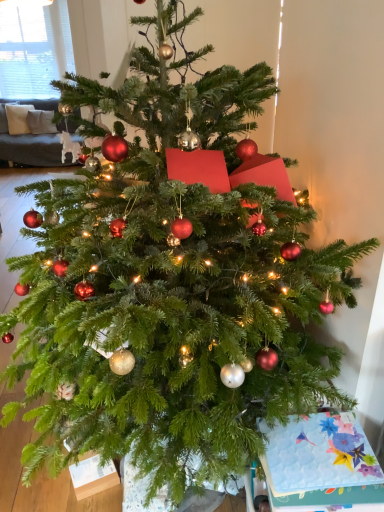
Question: Is white blinds at upper left wider or thinner than floral paper card at lower right?

Choices:
 (A) wide
 (B) thin

Answer: (B)

Question: Is white blinds at upper left inside the boundaries of floral paper card at lower right, or outside?

Choices:
 (A) outside
 (B) inside

Answer: (A)

Question: From the image's perspective, is white blinds at upper left above or below floral paper card at lower right?

Choices:
 (A) below
 (B) above

Answer: (B)

Question: In terms of height, does floral paper card at lower right look taller or shorter compared to white blinds at upper left?

Choices:
 (A) tall
 (B) short

Answer: (B)

Question: Is point (382, 473) positioned closer to the camera than point (39, 42)?

Choices:
 (A) farther
 (B) closer

Answer: (B)

Question: Do you think floral paper card at lower right is within white blinds at upper left, or outside of it?

Choices:
 (A) inside
 (B) outside

Answer: (B)

Question: From the image's perspective, is floral paper card at lower right above or below white blinds at upper left?

Choices:
 (A) below
 (B) above

Answer: (A)